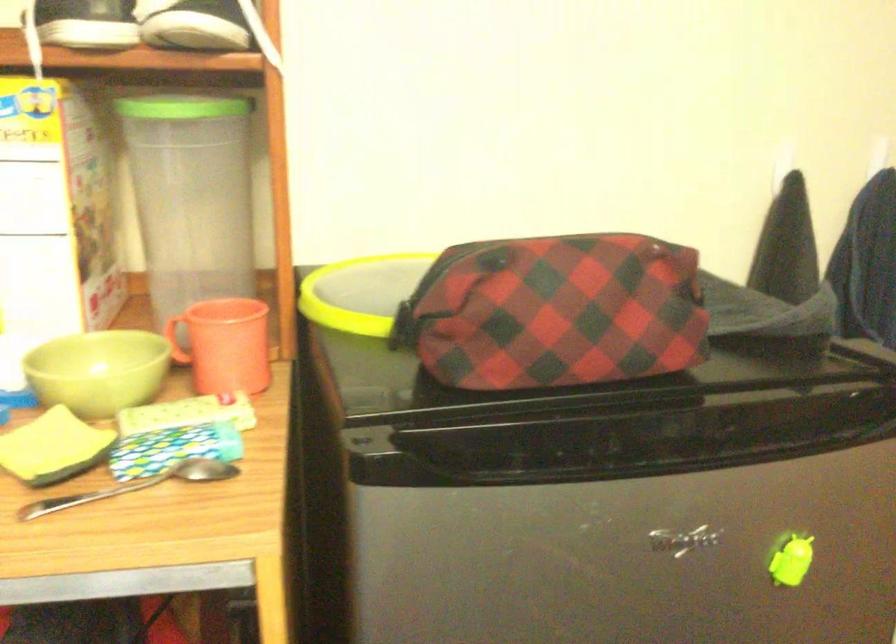
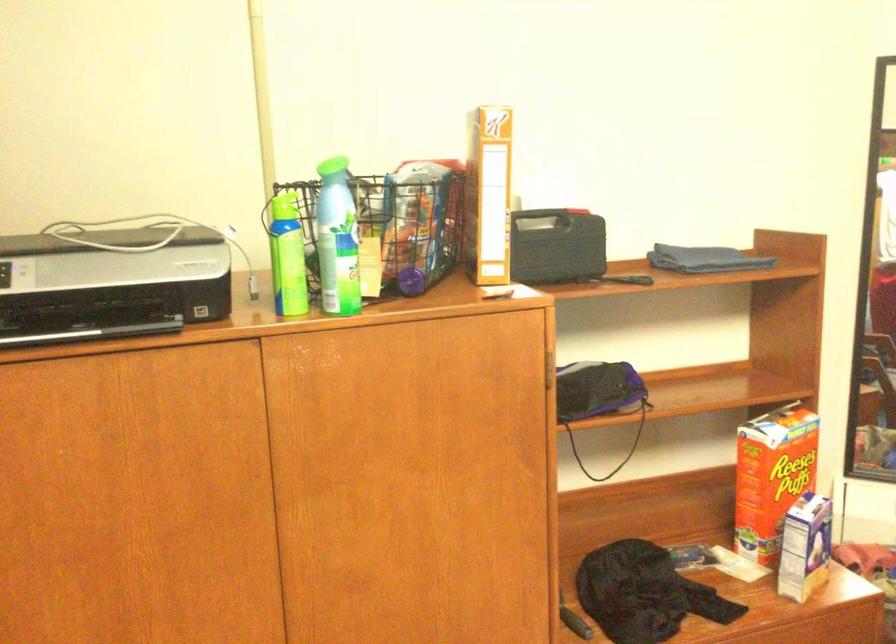
Question: Based on the continuous images, in which direction is the camera rotating? Reply with the corresponding letter.

Choices:
 (A) Left
 (B) Right
 (C) Up
 (D) Down

Answer: (B)